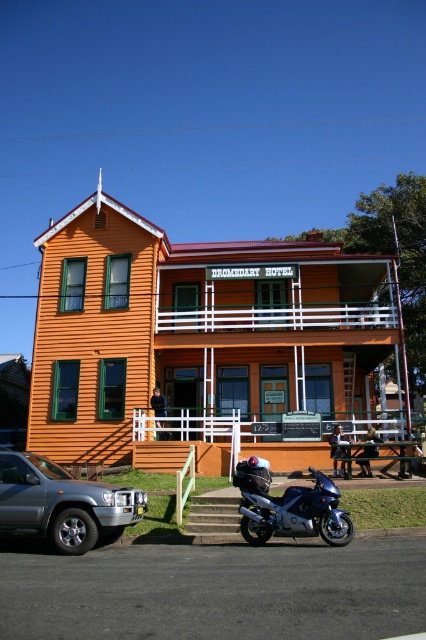
Does point (5, 451) come closer to viewer compared to point (256, 499)?

No, (5, 451) is behind (256, 499).

Where is `silver metallic suv at lower left`? The height and width of the screenshot is (640, 426). silver metallic suv at lower left is located at coordinates (63, 504).

The image size is (426, 640). I want to click on silver metallic suv at lower left, so click(63, 504).